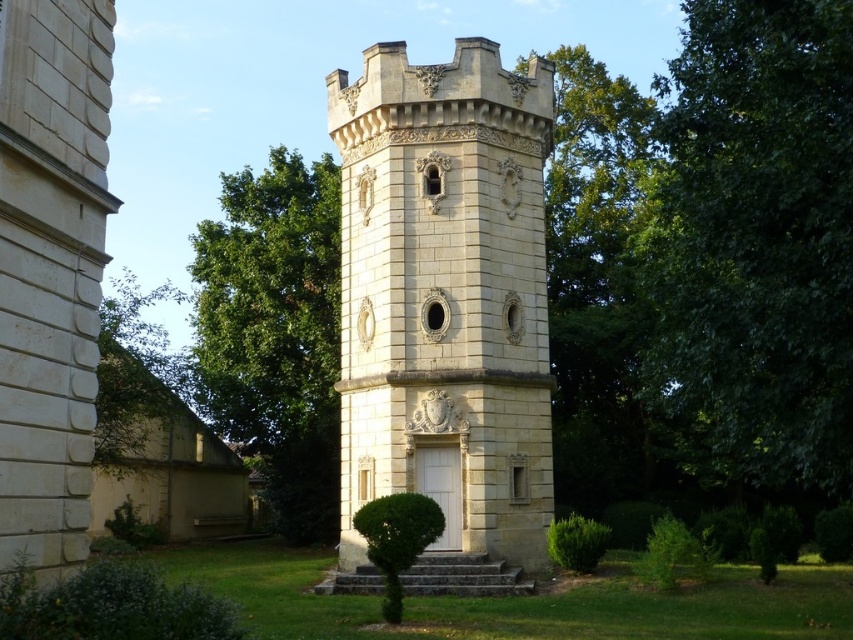
Question: Can you confirm if white stone tower at center is positioned below green leafy tree at center?

Choices:
 (A) no
 (B) yes

Answer: (B)

Question: Does white stone tower at center have a larger size compared to green leafy tree at center?

Choices:
 (A) no
 (B) yes

Answer: (A)

Question: Among these objects, which one is farthest from the camera?

Choices:
 (A) green leafy tree at center
 (B) white stone tower at center

Answer: (A)

Question: Does white stone tower at center appear on the left side of green leafy tree at center?

Choices:
 (A) yes
 (B) no

Answer: (B)